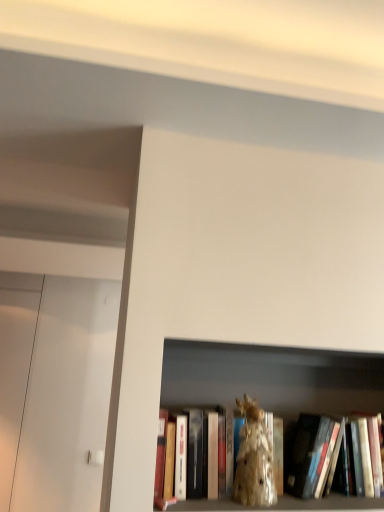
Locate an element on the screen. This screenshot has height=512, width=384. gold metallic statue at center is located at coordinates (329, 503).

The height and width of the screenshot is (512, 384). What do you see at coordinates (329, 503) in the screenshot? I see `gold metallic statue at center` at bounding box center [329, 503].

The width and height of the screenshot is (384, 512). Identify the location of shiny gold statue at center. (254, 459).

This screenshot has height=512, width=384. What do you see at coordinates (254, 459) in the screenshot? I see `shiny gold statue at center` at bounding box center [254, 459].

At what (x,y) coordinates should I click in order to perform the action: click on gold metallic statue at center. Please return your answer as a coordinate pair (x, y). The width and height of the screenshot is (384, 512). Looking at the image, I should click on (329, 503).

Does gold metallic statue at center appear on the left side of shiny gold statue at center?

In fact, gold metallic statue at center is to the right of shiny gold statue at center.

Is the depth of gold metallic statue at center greater than that of shiny gold statue at center?

Yes, the depth of gold metallic statue at center is greater than that of shiny gold statue at center.

Between point (302, 503) and point (253, 477), which one is positioned behind?

Positioned behind is point (302, 503).

From the image's perspective, which one is positioned higher, gold metallic statue at center or shiny gold statue at center?

shiny gold statue at center, from the image's perspective.

From a real-world perspective, is gold metallic statue at center positioned over shiny gold statue at center based on gravity?

Yes.

Considering the relative sizes of gold metallic statue at center and shiny gold statue at center in the image provided, is gold metallic statue at center thinner than shiny gold statue at center?

No, gold metallic statue at center is not thinner than shiny gold statue at center.

Considering the relative sizes of gold metallic statue at center and shiny gold statue at center in the image provided, is gold metallic statue at center taller than shiny gold statue at center?

Indeed, gold metallic statue at center has a greater height compared to shiny gold statue at center.

Looking at the image, does gold metallic statue at center seem bigger or smaller compared to shiny gold statue at center?

In the image, gold metallic statue at center appears to be larger than shiny gold statue at center.

Would you say shiny gold statue at center is part of gold metallic statue at center's contents?

Yes, shiny gold statue at center is a part of gold metallic statue at center.

Is gold metallic statue at center placed right next to shiny gold statue at center?

Yes, gold metallic statue at center is touching shiny gold statue at center.

Is gold metallic statue at center looking in the opposite direction of shiny gold statue at center?

Yes, gold metallic statue at center's orientation is away from shiny gold statue at center.

How distant is gold metallic statue at center from shiny gold statue at center?

gold metallic statue at center and shiny gold statue at center are 3.81 inches apart from each other.

I want to click on animal that appears below the gold metallic statue at center (from a real-world perspective), so click(254, 459).

Does shiny gold statue at center appear on the right side of gold metallic statue at center?

No.

Considering the relative positions of shiny gold statue at center and gold metallic statue at center in the image provided, is shiny gold statue at center in front of gold metallic statue at center?

That is True.

Which is closer to the camera, (241, 472) or (274, 435)?

Point (241, 472) is closer to the camera than point (274, 435).

From the image's perspective, between shiny gold statue at center and gold metallic statue at center, who is located below?

From the image's view, gold metallic statue at center is below.

From a real-world perspective, is shiny gold statue at center located beneath gold metallic statue at center?

Yes, from a real-world perspective, shiny gold statue at center is under gold metallic statue at center.

Based on the photo, considering the sizes of objects shiny gold statue at center and gold metallic statue at center in the image provided, who is wider, shiny gold statue at center or gold metallic statue at center?

With larger width is gold metallic statue at center.

Considering the sizes of objects shiny gold statue at center and gold metallic statue at center in the image provided, who is shorter, shiny gold statue at center or gold metallic statue at center?

shiny gold statue at center is shorter.

Looking at this image, which of these two, shiny gold statue at center or gold metallic statue at center, is smaller?

shiny gold statue at center is smaller.

Is shiny gold statue at center not inside gold metallic statue at center?

Actually, shiny gold statue at center is within gold metallic statue at center.

From the picture: Is shiny gold statue at center not close to gold metallic statue at center?

No.

Is shiny gold statue at center facing away from gold metallic statue at center?

Correct, shiny gold statue at center is looking away from gold metallic statue at center.

What's the angular difference between shiny gold statue at center and gold metallic statue at center's facing directions?

0.00134 degrees.

At what (x,y) coordinates should I click in order to perform the action: click on animal below the gold metallic statue at center (from a real-world perspective). Please return your answer as a coordinate pair (x, y). The height and width of the screenshot is (512, 384). Looking at the image, I should click on tap(254, 459).

Locate an element on the screen. The width and height of the screenshot is (384, 512). animal below the gold metallic statue at center (from a real-world perspective) is located at coordinates (254, 459).

Identify the location of animal lying on the left of gold metallic statue at center. (254, 459).